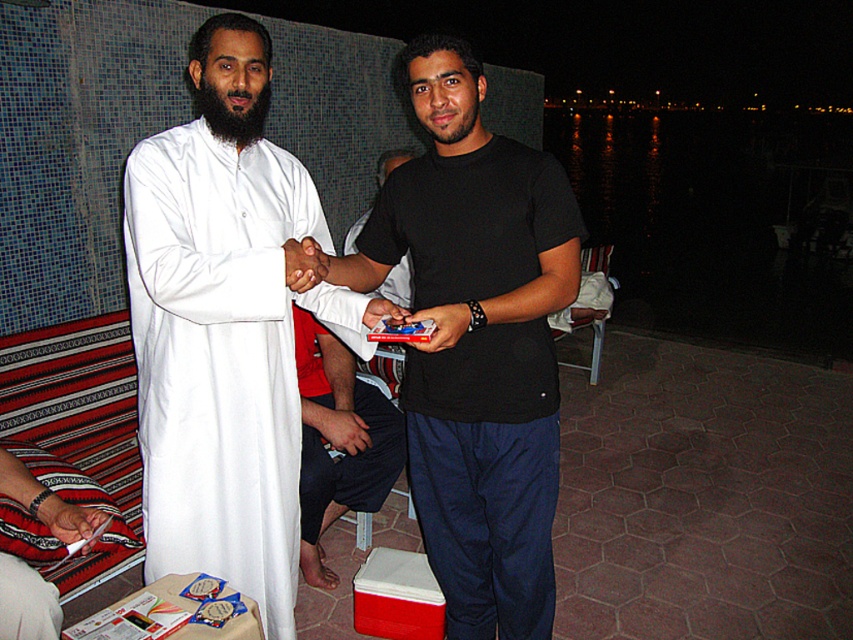
Who is more distant from viewer, (225, 253) or (320, 467)?

The point (320, 467) is more distant.

The height and width of the screenshot is (640, 853). What do you see at coordinates (223, 326) in the screenshot?
I see `white matte robe at center` at bounding box center [223, 326].

Measure the distance between white matte robe at center and camera.

5.08 feet

Where is `white matte robe at center`? The height and width of the screenshot is (640, 853). white matte robe at center is located at coordinates (223, 326).

Does smooth skin hand at center appear under matte plastic card at center?

Correct, smooth skin hand at center is located below matte plastic card at center.

Consider the image. Can you confirm if smooth skin hand at center is smaller than matte plastic card at center?

Incorrect, smooth skin hand at center is not smaller in size than matte plastic card at center.

Between point (334, 436) and point (422, 342), which one is positioned in front?

Positioned in front is point (422, 342).

At what (x,y) coordinates should I click in order to perform the action: click on smooth skin hand at center. Please return your answer as a coordinate pair (x, y). Looking at the image, I should click on (341, 428).

Can you confirm if black matte shirt at center is wider than white matte paper at lower left?

Yes.

Is black matte shirt at center below white matte paper at lower left?

Incorrect, black matte shirt at center is not positioned below white matte paper at lower left.

Locate an element on the screen. black matte shirt at center is located at coordinates (479, 342).